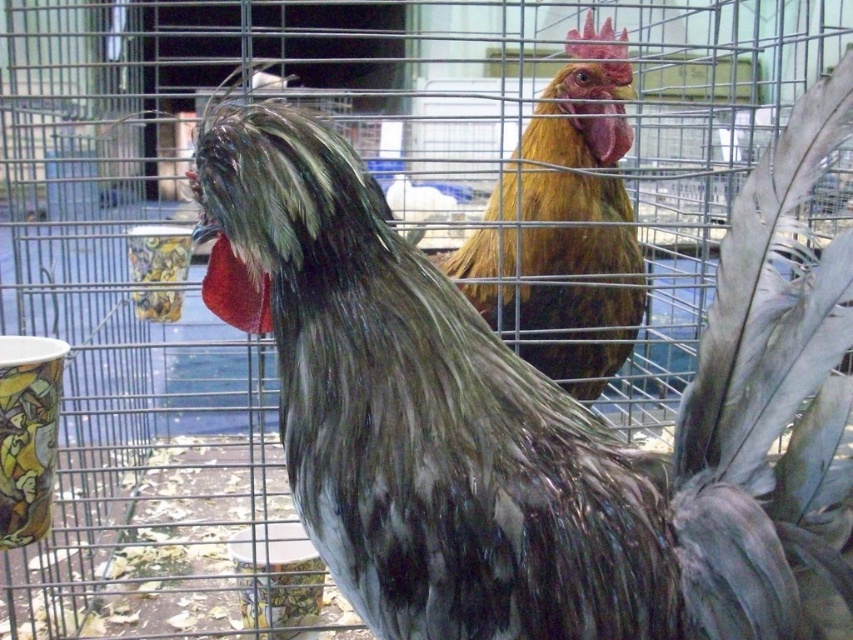
Question: Can you confirm if silvery-gray feathers at center is positioned above golden brown feathers at center?

Choices:
 (A) yes
 (B) no

Answer: (B)

Question: Which object is farther from the camera taking this photo?

Choices:
 (A) silvery-gray feathers at center
 (B) golden brown feathers at center

Answer: (B)

Question: Which of the following is the closest to the observer?

Choices:
 (A) (757, 173)
 (B) (601, 284)

Answer: (A)

Question: Can you confirm if silvery-gray feathers at center is smaller than golden brown feathers at center?

Choices:
 (A) no
 (B) yes

Answer: (B)

Question: Does silvery-gray feathers at center have a larger size compared to golden brown feathers at center?

Choices:
 (A) yes
 (B) no

Answer: (B)